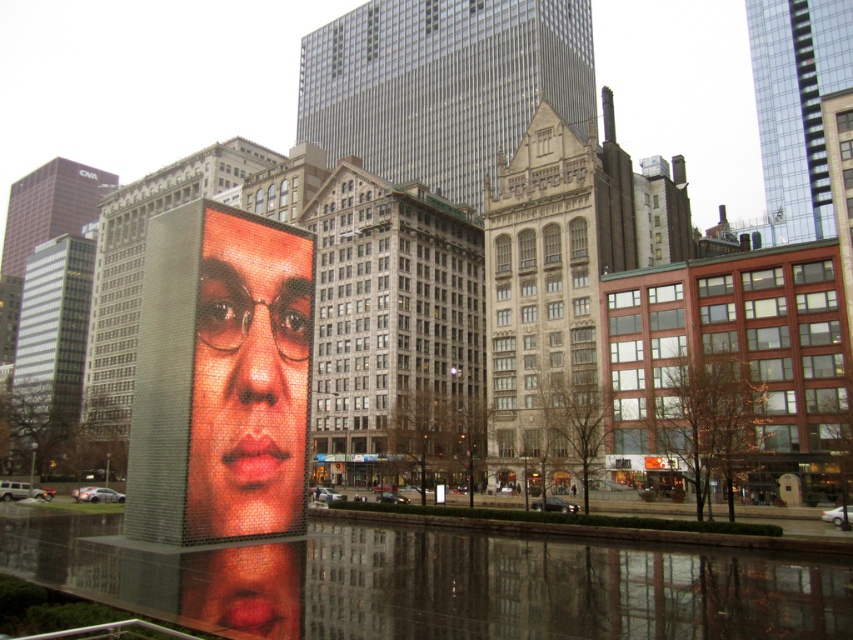
Who is taller, reflective glass water at center or polished mosaic face at center?

polished mosaic face at center is taller.

Is point (49, 577) positioned in front of point (274, 445)?

That is True.

Is point (107, 582) in front of point (222, 422)?

That is True.

Image resolution: width=853 pixels, height=640 pixels. I want to click on reflective glass water at center, so click(444, 582).